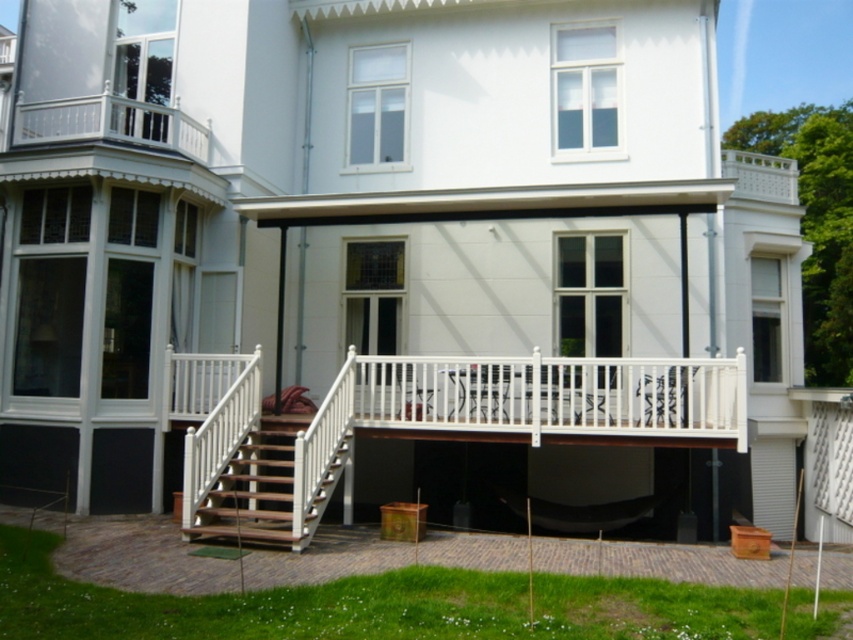
You are standing on the paved area in front of the house and want to reach the brown wooden deck at lower center. Based on the coordinates provided, in which direction should you move from your current position to reach it?

The brown wooden deck at lower center is located at coordinates point (x=138, y=557). Since you are on the paved area in front of the house, you should move towards the lower center direction to reach it.

You are standing at the point with coordinates (x=440, y=426) in the image of the house. What object are you standing on?

The point with coordinates (x=440, y=426) corresponds to the white wooden porch at center.

You are planning to place a large garden bench on the brown wooden deck at lower center and the wooden stairs at center. Based on the available space, which location would be more suitable for placing the bench?

The wooden stairs at center would be more suitable for placing the large garden bench because the brown wooden deck at lower center occupies less space than the wooden stairs at center, indicating the stairs area has more space available.